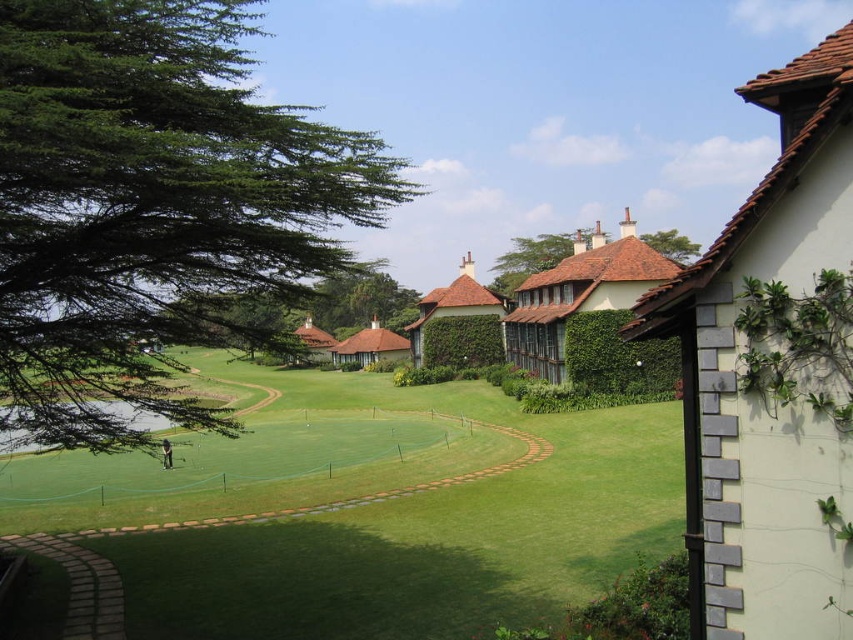
Can you confirm if green leafy tree at left is positioned above green leafy hedge at center-right?

Indeed, green leafy tree at left is positioned over green leafy hedge at center-right.

Based on the photo, is green leafy tree at left in front of green leafy hedge at center-right?

Yes, green leafy tree at left is closer to the viewer.

Who is more distant from viewer, (x=160, y=3) or (x=630, y=342)?

Positioned behind is point (x=630, y=342).

Locate an element on the screen. The image size is (853, 640). green leafy tree at left is located at coordinates (152, 208).

Can you confirm if green leafy tree at center is bigger than brown shingles roof at upper center?

Incorrect, green leafy tree at center is not larger than brown shingles roof at upper center.

Is green leafy tree at center smaller than brown shingles roof at upper center?

Yes, green leafy tree at center is smaller than brown shingles roof at upper center.

Who is more distant from viewer, (316, 308) or (682, 264)?

Positioned behind is point (316, 308).

This screenshot has width=853, height=640. I want to click on green leafy tree at center, so click(358, 298).

Can you confirm if green leafy tree at left is wider than brown shingles roof at upper center?

Yes.

Is green leafy tree at left taller than brown shingles roof at upper center?

Yes, green leafy tree at left is taller than brown shingles roof at upper center.

Locate an element on the screen. The image size is (853, 640). green leafy tree at left is located at coordinates (152, 208).

Where is `green leafy tree at left`? The width and height of the screenshot is (853, 640). green leafy tree at left is located at coordinates (152, 208).